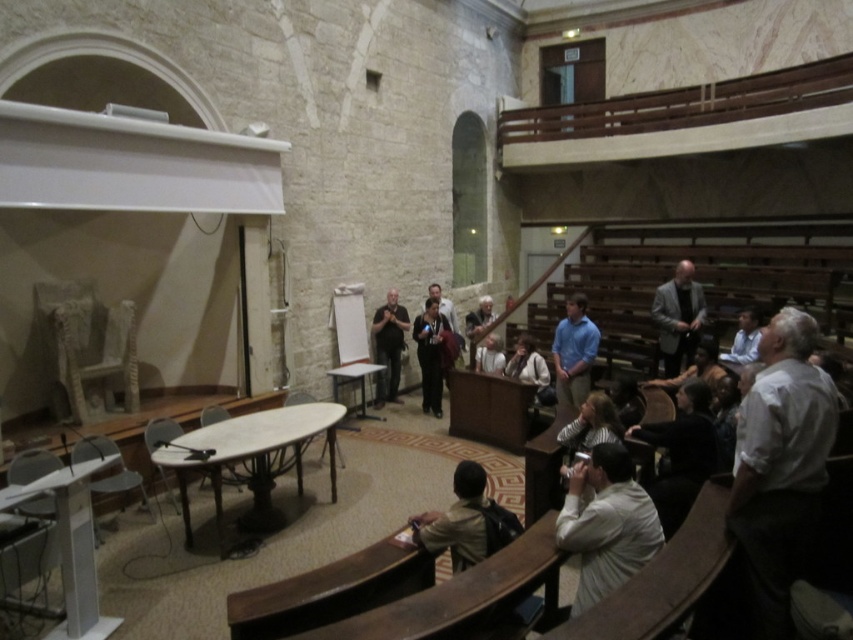
Between white shirt at right and dark gray shirt at center, which one appears on the right side from the viewer's perspective?

From the viewer's perspective, white shirt at right appears more on the right side.

Can you confirm if white shirt at right is smaller than dark gray shirt at center?

Actually, white shirt at right might be larger than dark gray shirt at center.

Does point (764, 634) lie behind point (381, 380)?

No, (764, 634) is in front of (381, 380).

The width and height of the screenshot is (853, 640). In order to click on white shirt at right in this screenshot , I will do `click(780, 465)`.

Can you confirm if light brown leather jacket at lower center is positioned to the left of dark gray suit at center?

Indeed, light brown leather jacket at lower center is positioned on the left side of dark gray suit at center.

Which is behind, point (465, 500) or point (676, 332)?

Point (676, 332)

Where is `light brown leather jacket at lower center`? Image resolution: width=853 pixels, height=640 pixels. light brown leather jacket at lower center is located at coordinates (466, 522).

Is light brown leather jacket at lower center wider than light brown wooden guitar at center?

Yes.

Locate an element on the screen. Image resolution: width=853 pixels, height=640 pixels. light brown leather jacket at lower center is located at coordinates (466, 522).